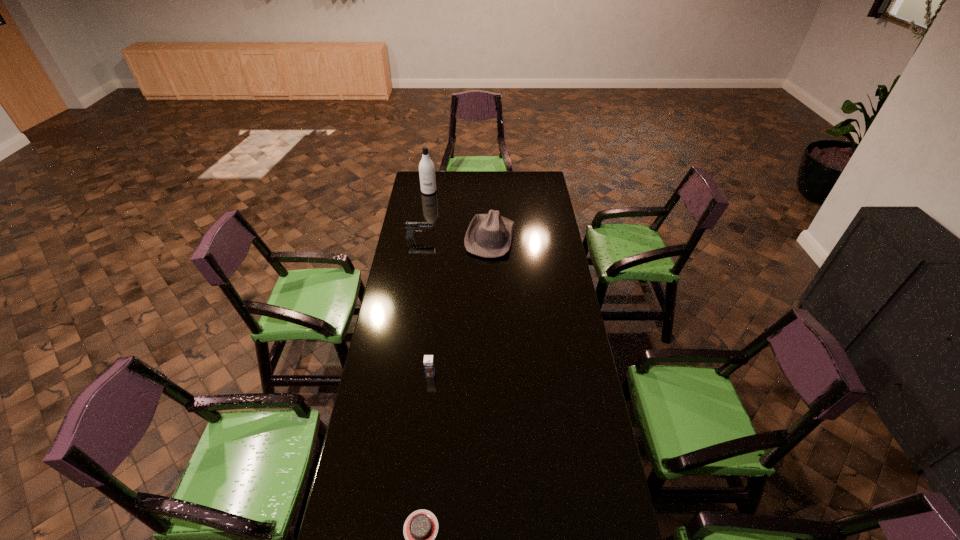
Locate an element on the screen. The height and width of the screenshot is (540, 960). the tallest object is located at coordinates (x=426, y=167).

Where is `shampoo`? This screenshot has width=960, height=540. shampoo is located at coordinates (426, 167).

This screenshot has width=960, height=540. I want to click on fedora, so click(490, 235).

The height and width of the screenshot is (540, 960). I want to click on the rightmost object, so click(x=490, y=235).

This screenshot has width=960, height=540. Find the location of `pistol`. pistol is located at coordinates click(410, 226).

This screenshot has width=960, height=540. Find the location of `chocolate milk`. chocolate milk is located at coordinates (428, 362).

Identify the location of vacant space positioned 0.240m on the front-facing side of the shampoo. This screenshot has height=540, width=960. (424, 219).

The height and width of the screenshot is (540, 960). In order to click on free location located 0.160m on the left of the fedora in this screenshot , I will do `click(435, 237)`.

The image size is (960, 540). In order to click on vacant space located 0.270m aim along the barrel of the pistol in this screenshot , I will do `click(484, 238)`.

You are a GUI agent. You are given a task and a screenshot of the screen. Output one action in this format:
    pyautogui.click(x=<x>, y=<y>)
    Task: Click on the blank space located 0.270m on the front label of the chocolate milk
    This screenshot has width=960, height=540.
    Given the screenshot: What is the action you would take?
    pyautogui.click(x=423, y=443)